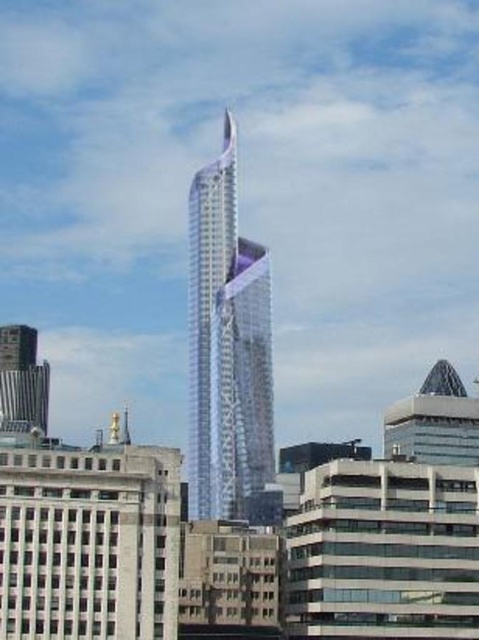
You are an architect evaluating the cityscape. You need to determine which tower has a greater height. You can only see the sleek glass tower at center and the metallic silver tower at lower left. Which one is taller?

The sleek glass tower at center is taller than the metallic silver tower at lower left because it is described as larger in size.

You are standing in the city and want to take a photo of the sleek glass tower at center and the metallic silver tower at lower left. Which tower will appear larger in your camera view?

The sleek glass tower at center appears larger in your camera view because it is closer to you than the metallic silver tower at lower left.

You are standing in the city and want to take a photo of the skyscraper. If you are at point [205,237], which is 348.08 meters away from the skyscraper, can you capture the entire skyscraper in your camera frame without moving? Please consider the camera has a standard 50mm lens.

The point [205,237] is 348.08 meters away from the skyscraper. With a standard 50mm lens, the field of view might be sufficient to capture the entire skyscraper if it isn however, the exact ability depends on the skyscraper height and your camera sensor size. Without specific dimensions, it is uncertain.